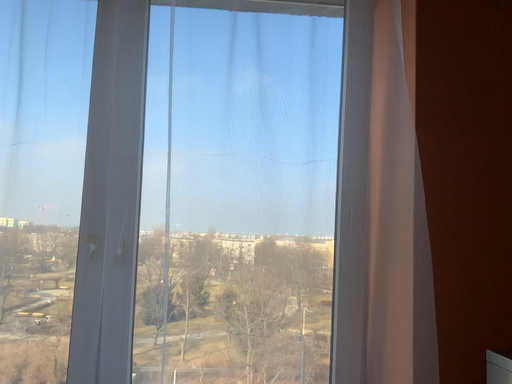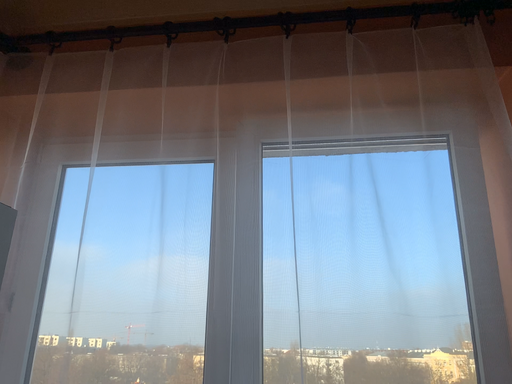
Question: How did the camera likely rotate when shooting the video?

Choices:
 (A) rotated right
 (B) rotated left

Answer: (B)